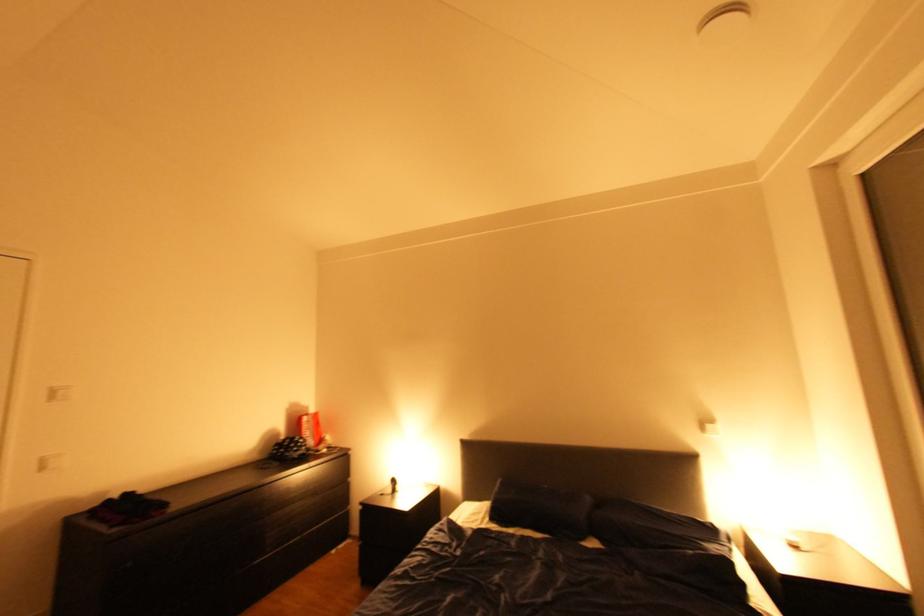
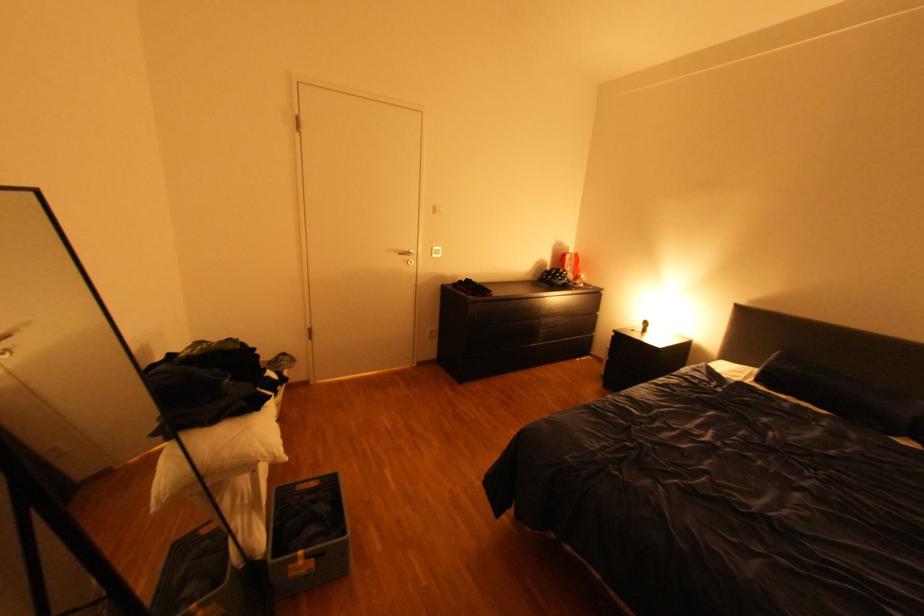
The images are taken continuously from a first-person perspective. In which direction is your viewpoint rotating?

The camera rotated toward left-down.